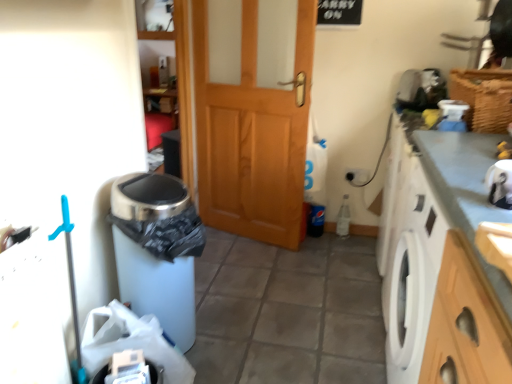
Locate an element on the screen. The image size is (512, 384). vacant space underneath wooden door at center (from a real-world perspective) is located at coordinates (252, 234).